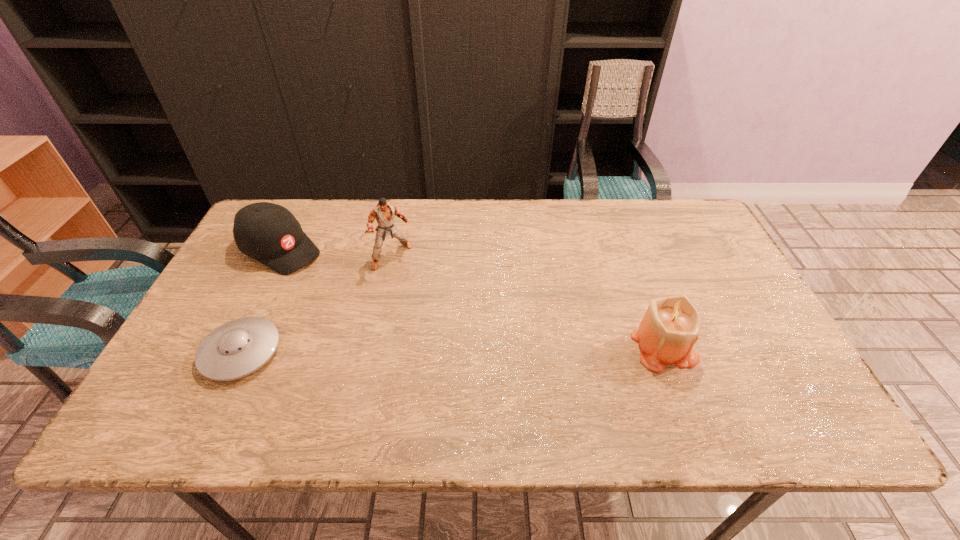
Locate an element on the screen. object that is at the near left corner is located at coordinates (237, 348).

Image resolution: width=960 pixels, height=540 pixels. Identify the location of vacant space at the far edge of the desktop. (460, 239).

Image resolution: width=960 pixels, height=540 pixels. I want to click on vacant point at the near edge, so click(712, 365).

This screenshot has width=960, height=540. Identify the location of vacant space at the left edge. (226, 273).

The height and width of the screenshot is (540, 960). Find the location of `blank area at the right edge`. blank area at the right edge is located at coordinates (747, 315).

Where is `blank space at the far right corner of the desktop`? This screenshot has height=540, width=960. blank space at the far right corner of the desktop is located at coordinates (708, 242).

Identify the location of free space between the third tallest object and the rightmost object. (472, 298).

This screenshot has height=540, width=960. I want to click on vacant area that lies between the second shortest object and the candle, so click(x=472, y=298).

Locate an element on the screen. The height and width of the screenshot is (540, 960). free space between the third tallest object and the puncher is located at coordinates (337, 253).

Image resolution: width=960 pixels, height=540 pixels. Find the location of `free area in between the candle and the saucer`. free area in between the candle and the saucer is located at coordinates (452, 349).